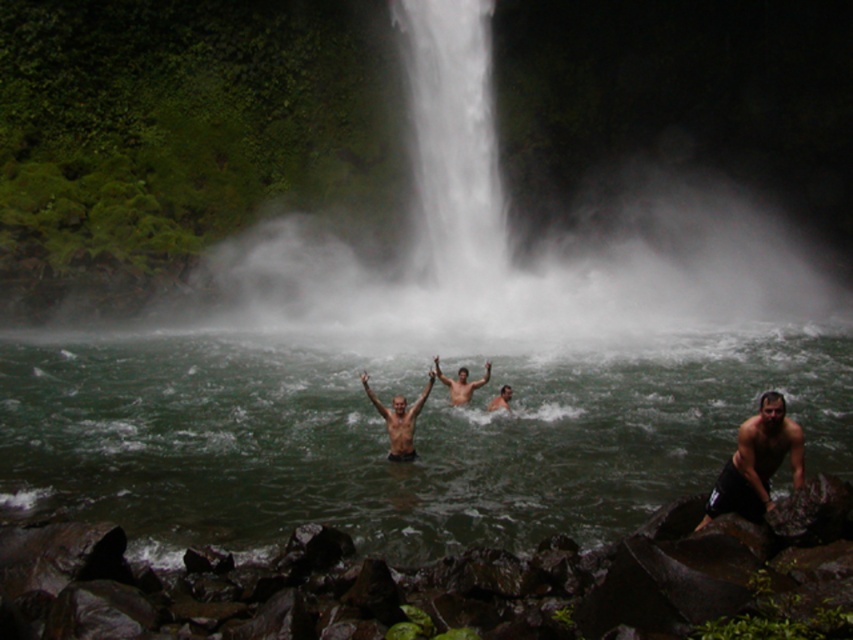
Question: Can you confirm if white misty waterfall at center is positioned above black matte shorts at lower right?

Choices:
 (A) no
 (B) yes

Answer: (B)

Question: Which point is farther to the camera?

Choices:
 (A) black matte shorts at lower right
 (B) green water at center
 (C) smooth skin person at center

Answer: (C)

Question: From the image, what is the correct spatial relationship of white misty waterfall at center in relation to shiny skin person at center?

Choices:
 (A) right
 (B) left

Answer: (A)

Question: Can you confirm if green water at center is wider than shiny skin man at center?

Choices:
 (A) no
 (B) yes

Answer: (B)

Question: Among these objects, which one is nearest to the camera?

Choices:
 (A) smooth skin person at center
 (B) white misty waterfall at center
 (C) shiny skin person at center
 (D) green water at center

Answer: (D)

Question: Which object is the farthest from the shiny skin person at center?

Choices:
 (A) black matte shorts at lower right
 (B) green water at center

Answer: (A)